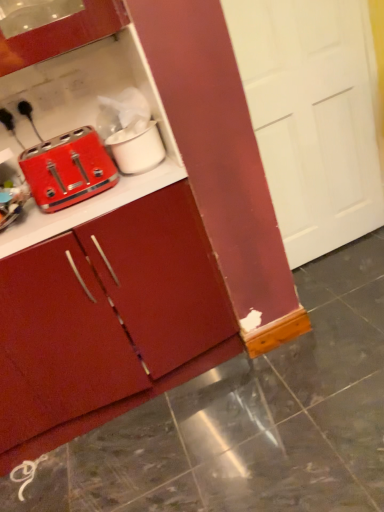
This screenshot has width=384, height=512. I want to click on vacant area that is situated to the right of matte red cabinet at center, so click(x=284, y=380).